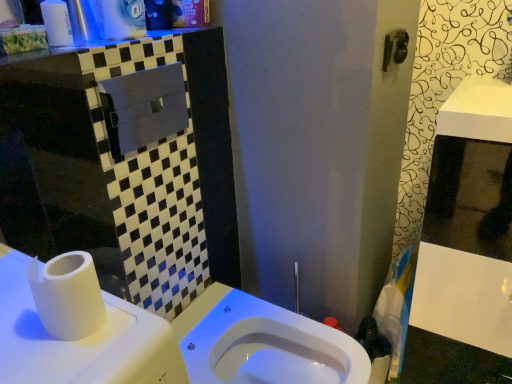
Where is `white matte toilet paper at left`? white matte toilet paper at left is located at coordinates (68, 295).

Where is `white plastic cup at upper left`? white plastic cup at upper left is located at coordinates (57, 23).

Locate an element on the screen. This screenshot has width=512, height=384. white matte toilet paper at left is located at coordinates (68, 295).

Considering the relative positions of white plastic cup at upper left and white glossy counter top at upper left in the image provided, is white plastic cup at upper left to the left of white glossy counter top at upper left from the viewer's perspective?

Indeed, white plastic cup at upper left is positioned on the left side of white glossy counter top at upper left.

From a real-world perspective, is white plastic cup at upper left on white glossy counter top at upper left?

Correct, in the physical world, white plastic cup at upper left is higher than white glossy counter top at upper left.

In the scene shown: Is white plastic cup at upper left next to white glossy counter top at upper left and touching it?

white plastic cup at upper left and white glossy counter top at upper left are clearly separated.

From the image's perspective, which one is positioned higher, white matte toilet paper at left or white glossy counter top at upper left?

white glossy counter top at upper left is shown above in the image.

Does point (35, 260) come closer to viewer compared to point (98, 45)?

Yes, it is in front of point (98, 45).

Between white matte toilet paper at left and white glossy counter top at upper left, which one has larger width?

Wider between the two is white glossy counter top at upper left.

The height and width of the screenshot is (384, 512). What are the coordinates of `counter top lying above the white matte toilet paper at left (from the image's perspective)` in the screenshot? It's located at (35, 55).

Is white matte toilet paper at left positioned with its back to white glossy medicine cabinet at right?

No, white matte toilet paper at left is not facing away from white glossy medicine cabinet at right.

From the image's perspective, is white matte toilet paper at left above or below white glossy medicine cabinet at right?

white matte toilet paper at left is above white glossy medicine cabinet at right.

Is white matte toilet paper at left at the right side of white glossy medicine cabinet at right?

Incorrect, white matte toilet paper at left is not on the right side of white glossy medicine cabinet at right.

From a real-world perspective, is white matte toilet paper at left above or below white glossy medicine cabinet at right?

white matte toilet paper at left is situated higher than white glossy medicine cabinet at right in the real world.

Who is smaller, white plastic cup at upper left or white matte toilet paper at left?

white plastic cup at upper left.

Is white plastic cup at upper left positioned with its back to white matte toilet paper at left?

white plastic cup at upper left is not turned away from white matte toilet paper at left.

Would you say white matte toilet paper at left is part of white plastic cup at upper left's contents?

No, white matte toilet paper at left is located outside of white plastic cup at upper left.

How different are the orientations of white plastic cup at upper left and white matte toilet paper at left in degrees?

There is a 0.189-degree angle between the facing directions of white plastic cup at upper left and white matte toilet paper at left.

Is white glossy toilet at center completely or partially outside of white glossy counter top at upper left?

white glossy toilet at center is positioned outside white glossy counter top at upper left.

From a real-world perspective, is white glossy toilet at center above or below white glossy counter top at upper left?

Clearly, from a real-world perspective, white glossy toilet at center is below white glossy counter top at upper left.

In terms of height, does white glossy toilet at center look taller or shorter compared to white glossy counter top at upper left?

Considering their sizes, white glossy toilet at center has more height than white glossy counter top at upper left.

Can you confirm if white glossy toilet at center is positioned to the left of white glossy counter top at upper left?

No, white glossy toilet at center is not to the left of white glossy counter top at upper left.

Is the depth of white glossy medicine cabinet at right greater than that of white plastic cup at upper left?

That is True.

From the image's perspective, between white glossy medicine cabinet at right and white plastic cup at upper left, who is located below?

white glossy medicine cabinet at right is shown below in the image.

Can you see white glossy medicine cabinet at right touching white plastic cup at upper left?

No, white glossy medicine cabinet at right is not making contact with white plastic cup at upper left.

Would you say white matte toilet paper at left contains white plastic cup at upper left?

No, white plastic cup at upper left is located outside of white matte toilet paper at left.

Are white matte toilet paper at left and white plastic cup at upper left far apart?

Actually, white matte toilet paper at left and white plastic cup at upper left are a little close together.

Is white matte toilet paper at left closer to camera compared to white plastic cup at upper left?

Yes, it is.

This screenshot has height=384, width=512. I want to click on toiletry above the white glossy counter top at upper left (from a real-world perspective), so click(x=57, y=23).

You are a GUI agent. You are given a task and a screenshot of the screen. Output one action in this format:
    pyautogui.click(x=<x>, y=<y>)
    Task: Click on the counter top on the left of white matte toilet paper at left
    
    Given the screenshot: What is the action you would take?
    pyautogui.click(x=35, y=55)

Estimate the real-world distances between objects in this image. Which object is further from white glossy medicine cabinet at right, white plastic cup at upper left or white matte toilet paper at left?

white plastic cup at upper left.

From the image, which object appears to be farther from white glossy toilet at center, white matte toilet paper at left or white glossy counter top at upper left?

Based on the image, white glossy counter top at upper left appears to be further to white glossy toilet at center.

Based on their spatial positions, is white matte toilet paper at left or white glossy counter top at upper left further from white plastic cup at upper left?

Among the two, white matte toilet paper at left is located further to white plastic cup at upper left.

Considering their positions, is white glossy toilet at center positioned closer to white glossy medicine cabinet at right than white glossy counter top at upper left?

white glossy toilet at center.

Looking at the image, which one is located further to white matte toilet paper at left, white glossy counter top at upper left or white plastic cup at upper left?

Based on the image, white plastic cup at upper left appears to be further to white matte toilet paper at left.

When comparing their distances from white glossy counter top at upper left, does white glossy toilet at center or white plastic cup at upper left seem further?

Among the two, white glossy toilet at center is located further to white glossy counter top at upper left.

From the image, which object appears to be nearer to white matte toilet paper at left, white plastic cup at upper left or white glossy medicine cabinet at right?

white plastic cup at upper left lies closer to white matte toilet paper at left than the other object.

In the scene shown: Based on their spatial positions, is white glossy counter top at upper left or white glossy toilet at center further from white matte toilet paper at left?

white glossy toilet at center is further to white matte toilet paper at left.

Where is `toilet paper that lies between white plastic cup at upper left and white glossy toilet at center from top to bottom`? toilet paper that lies between white plastic cup at upper left and white glossy toilet at center from top to bottom is located at coordinates (68, 295).

Where is `counter top between white plastic cup at upper left and white glossy toilet at center from top to bottom`? counter top between white plastic cup at upper left and white glossy toilet at center from top to bottom is located at coordinates (35, 55).

What are the coordinates of `toilet paper between white glossy counter top at upper left and white glossy medicine cabinet at right` in the screenshot? It's located at (68, 295).

Where is `counter top between white plastic cup at upper left and white matte toilet paper at left in the up-down direction`? The width and height of the screenshot is (512, 384). counter top between white plastic cup at upper left and white matte toilet paper at left in the up-down direction is located at coordinates (35, 55).